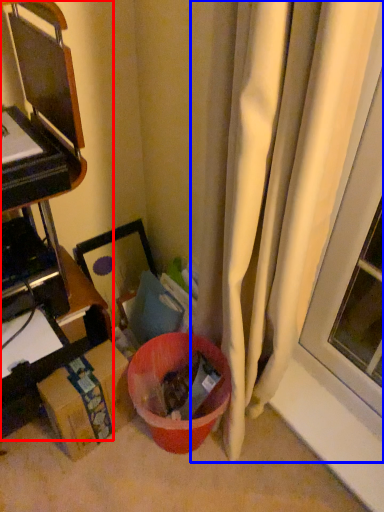
Question: Which point is further to the camera, furniture (highlighted by a red box) or curtain (highlighted by a blue box)?

Choices:
 (A) furniture
 (B) curtain

Answer: (A)